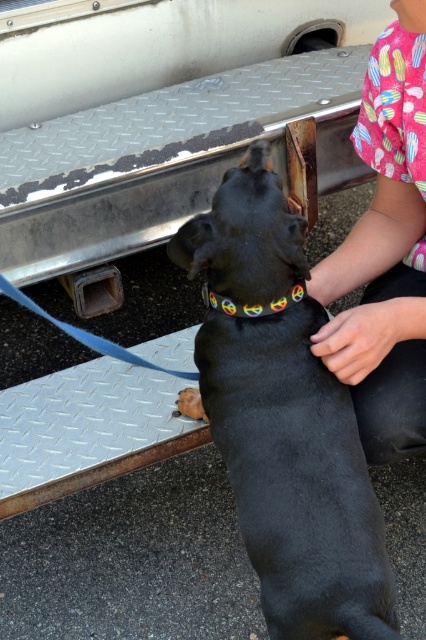
Based on the photo, you are a delivery robot trying to navigate around the black rubber dog at center and the pink fabric shirt at upper right. The robot has a width of 30 centimeters. Can you safely pass between them without hitting either?

The black rubber dog at center is 20.58 centimeters from the pink fabric shirt at upper right. Since the robot is 30 centimeters wide, it cannot safely pass between them as the distance is narrower than the robot.

You are standing at the center of the image and want to hand a treat to the person wearing the pink fabric shirt at upper right. In which direction should you move to approach them?

The pink fabric shirt at upper right is located at point (385, 252), so you should move towards the upper right direction to approach them.

The black rubber dog at center is 36.74 inches away from the person in the pink shirt. Can a 30 inch long toy fit between them?

Yes, the 30 inch long toy can fit between the black rubber dog at center and the person in the pink shirt because the distance between them is 36.74 inches, which is longer than the toy.